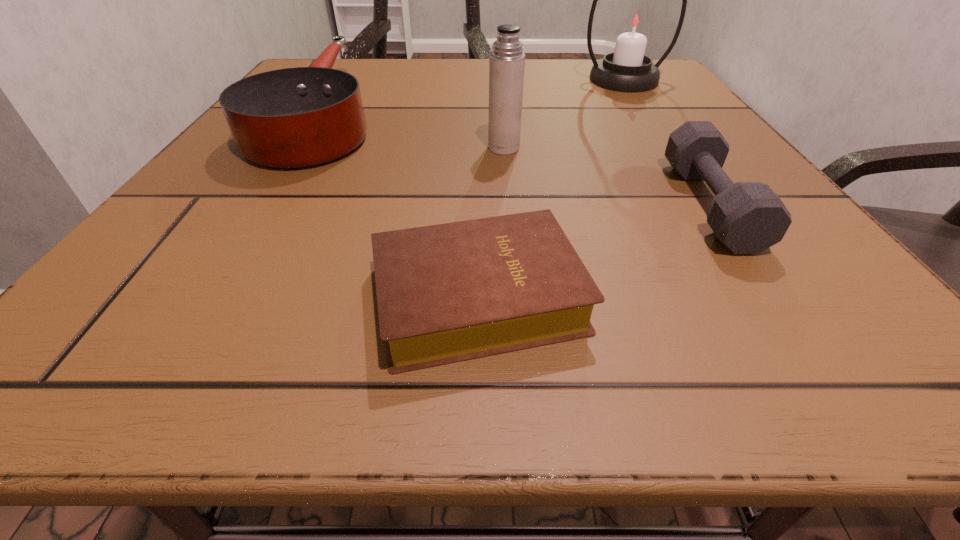
In order to click on vacant area at the far edge of the desktop in this screenshot , I will do `click(476, 71)`.

Locate an element on the screen. This screenshot has width=960, height=540. vacant space at the left edge of the desktop is located at coordinates (225, 187).

Identify the location of free region at the right edge of the desktop. (810, 262).

Where is `vacant area at the far right corner of the desktop`? This screenshot has width=960, height=540. vacant area at the far right corner of the desktop is located at coordinates (665, 86).

You are a GUI agent. You are given a task and a screenshot of the screen. Output one action in this format:
    pyautogui.click(x=<x>, y=<y>)
    Task: Click on the unoccupied area between the oil lamp and the dumbbell
    
    Given the screenshot: What is the action you would take?
    pyautogui.click(x=666, y=142)

Where is `free space between the second shortest object and the oil lamp`? The height and width of the screenshot is (540, 960). free space between the second shortest object and the oil lamp is located at coordinates (666, 142).

Find the location of a particular element. This screenshot has height=540, width=960. vacant space that's between the leftmost object and the second tallest object is located at coordinates (413, 131).

You are a GUI agent. You are given a task and a screenshot of the screen. Output one action in this format:
    pyautogui.click(x=<x>, y=<y>)
    Task: Click on the blank region between the second tallest object and the oil lamp
    The height and width of the screenshot is (540, 960).
    Given the screenshot: What is the action you would take?
    pyautogui.click(x=564, y=114)

In order to click on free space between the leftmost object and the dumbbell in this screenshot , I will do `click(516, 159)`.

What are the coordinates of `empty space that is in between the third shortest object and the thermos bottle` in the screenshot? It's located at (413, 131).